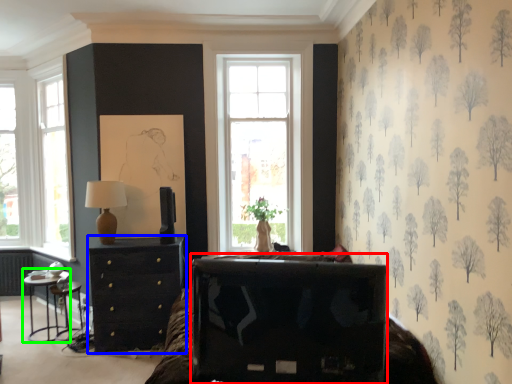
Question: Considering the real-world distances, which object is farthest from furniture (highlighted by a red box)? chest of drawers (highlighted by a blue box) or table (highlighted by a green box)?

Choices:
 (A) chest of drawers
 (B) table

Answer: (B)